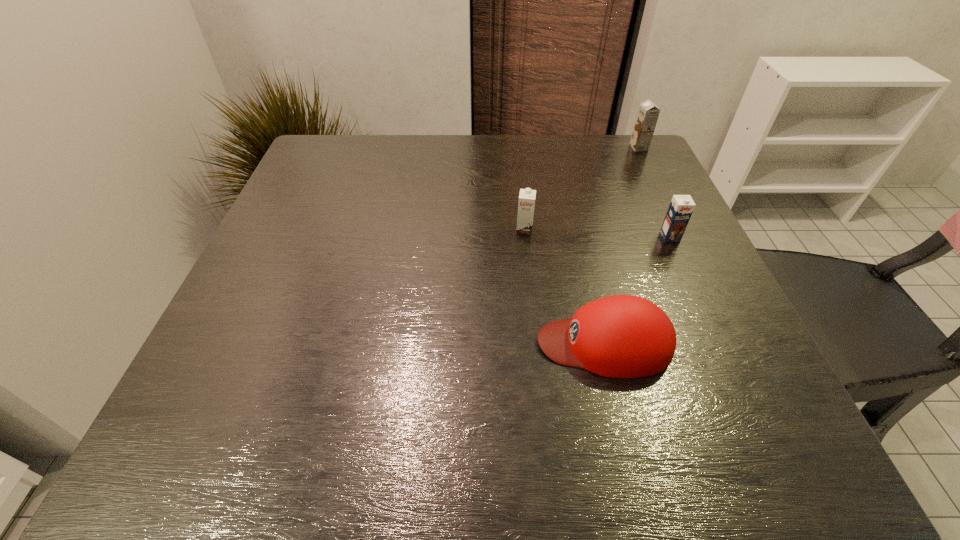
You are a GUI agent. You are given a task and a screenshot of the screen. Output one action in this format:
    pyautogui.click(x=<x>, y=<y>)
    Task: Click on the tallest chocolate milk
    The width and height of the screenshot is (960, 540).
    Given the screenshot: What is the action you would take?
    pyautogui.click(x=648, y=113)

Where is `the farthest chocolate milk`? the farthest chocolate milk is located at coordinates (648, 113).

The height and width of the screenshot is (540, 960). I want to click on the leftmost chocolate milk, so click(526, 204).

Locate an element on the screen. This screenshot has height=540, width=960. baseball cap is located at coordinates (622, 336).

At what (x,y) coordinates should I click in order to perform the action: click on free region located 0.150m on the front of the farthest chocolate milk. Please return your answer as a coordinate pair (x, y). Looking at the image, I should click on (657, 183).

At what (x,y) coordinates should I click in order to perform the action: click on free spot located on the right of the leftmost chocolate milk. Please return your answer as a coordinate pair (x, y). Looking at the image, I should click on (666, 230).

You are a GUI agent. You are given a task and a screenshot of the screen. Output one action in this format:
    pyautogui.click(x=<x>, y=<y>)
    Task: Click on the vacant area located 0.260m on the front-facing side of the baseball cap
    
    Given the screenshot: What is the action you would take?
    pyautogui.click(x=384, y=343)

Image resolution: width=960 pixels, height=540 pixels. What are the coordinates of `free region located on the front-facing side of the baseball cap` in the screenshot? It's located at (314, 343).

Locate an element on the screen. The image size is (960, 540). free space located on the front-facing side of the baseball cap is located at coordinates (390, 343).

Identify the location of object at the far edge. (648, 113).